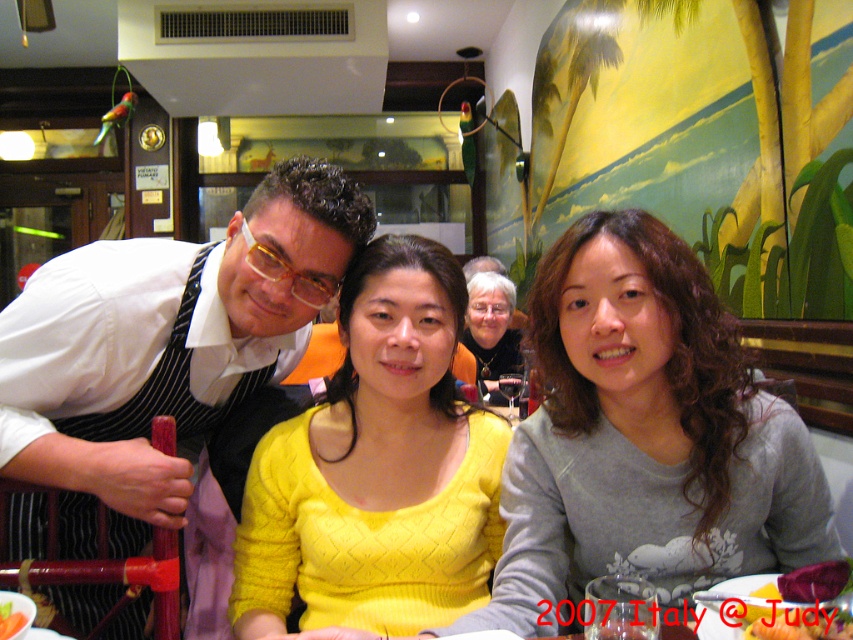
Is point (685, 285) behind point (7, 620)?

Yes, point (685, 285) is behind point (7, 620).

Who is positioned more to the right, gray matte sweater at center or smooth tomato at center?

gray matte sweater at center is more to the right.

Does point (558, 422) lie in front of point (12, 634)?

No, (558, 422) is behind (12, 634).

Where is `gray matte sweater at center`? Image resolution: width=853 pixels, height=640 pixels. gray matte sweater at center is located at coordinates (643, 436).

Does white shirt at left appear on the left side of smooth tomato at center?

Incorrect, white shirt at left is not on the left side of smooth tomato at center.

Is white shirt at left positioned at the back of smooth tomato at center?

That is True.

Which is behind, point (41, 355) or point (19, 625)?

Positioned behind is point (41, 355).

This screenshot has width=853, height=640. Find the location of `white shirt at left`. white shirt at left is located at coordinates (169, 353).

Does gray matte sweater at center have a larger size compared to matte black hair at center?

No.

Who is taller, gray matte sweater at center or matte black hair at center?

gray matte sweater at center is taller.

Is point (523, 561) in front of point (482, 339)?

Yes, point (523, 561) is in front of point (482, 339).

The image size is (853, 640). In order to click on gray matte sweater at center in this screenshot , I will do (x=643, y=436).